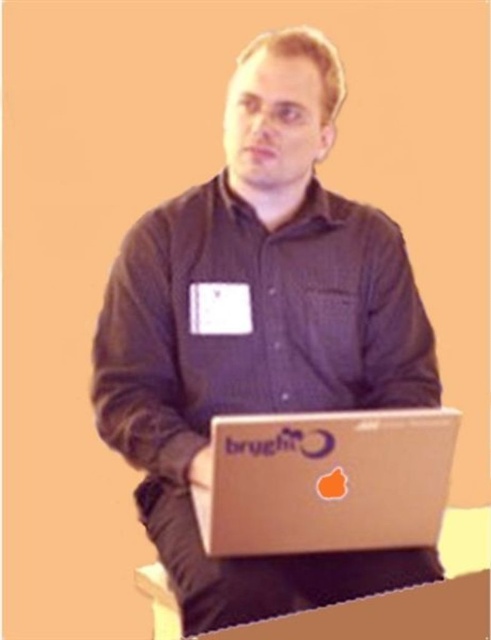
You are an interior designer trying to place a new lamp in the room. The lamp needs to be placed at coordinates point 0.5, 0.5. Is the matte black laptop at center in the way?

The matte black laptop at center is located at point (258, 332), which is very close to the desired coordinates of (245, 320). Depending on the size of the lamp and the available space, the laptop might be in the way and require relocation for proper placement.